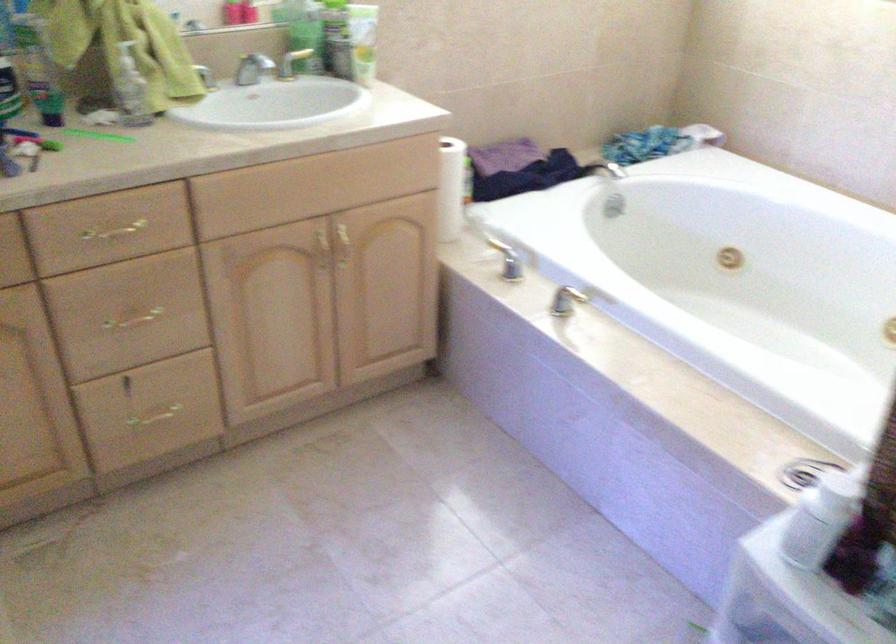
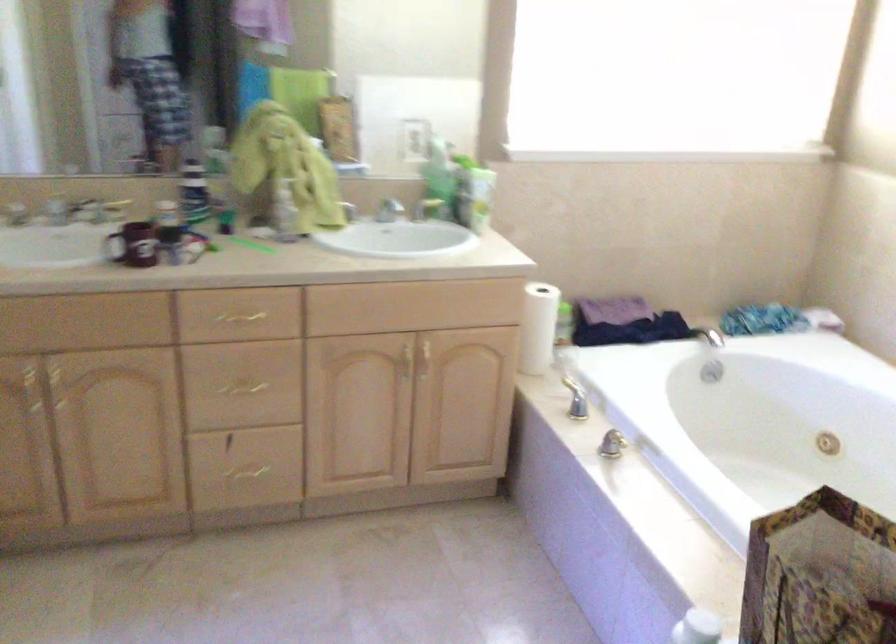
Question: The camera is either moving clockwise (left) or counter-clockwise (right) around the object. The first image is from the beginning of the video and the second image is from the end. Is the camera moving left or right when shooting the video?

Choices:
 (A) Left
 (B) Right

Answer: (B)